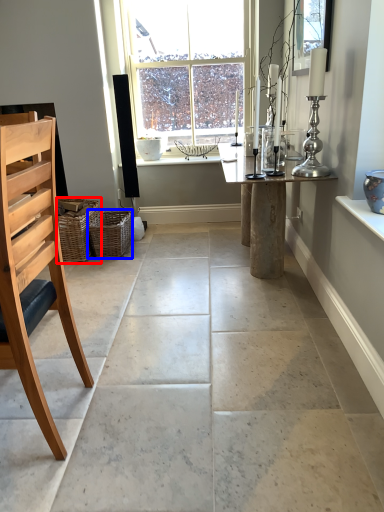
Question: Which point is further to the camera, basket (highlighted by a red box) or basket (highlighted by a blue box)?

Choices:
 (A) basket
 (B) basket

Answer: (B)